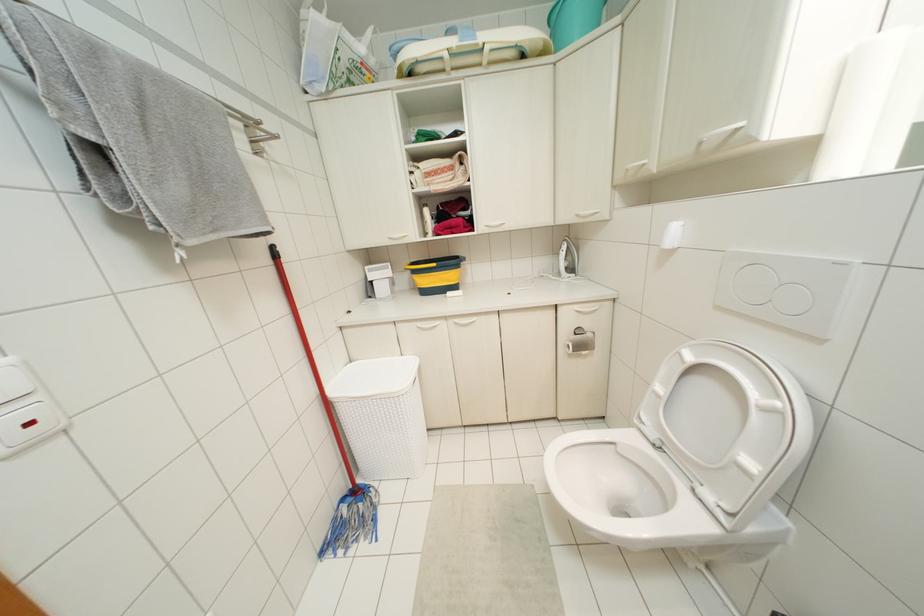
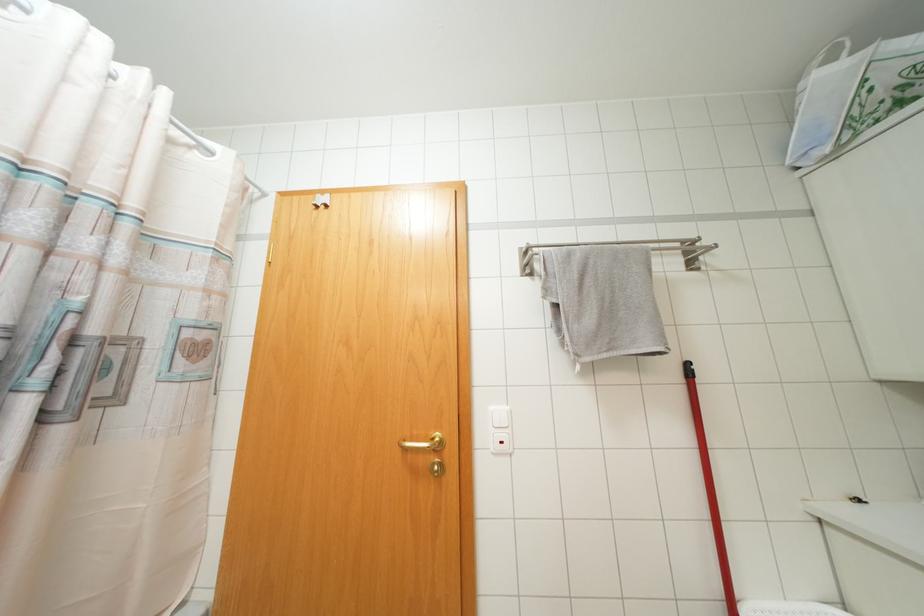
Question: The images are taken continuously from a first-person perspective. In which direction is your viewpoint rotating?

Choices:
 (A) Left
 (B) Right
 (C) Up
 (D) Down

Answer: (A)